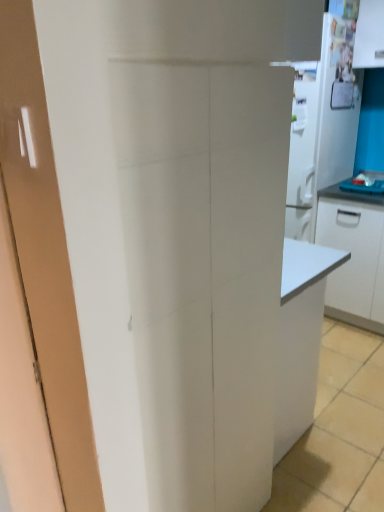
Question: Can you confirm if white glossy refrigerator at upper right is positioned to the left of blue laminate countertop at right?

Choices:
 (A) no
 (B) yes

Answer: (B)

Question: From the image's perspective, is white glossy refrigerator at upper right beneath blue laminate countertop at right?

Choices:
 (A) yes
 (B) no

Answer: (B)

Question: Is white glossy refrigerator at upper right positioned with its back to blue laminate countertop at right?

Choices:
 (A) no
 (B) yes

Answer: (A)

Question: Is white glossy refrigerator at upper right further to camera compared to blue laminate countertop at right?

Choices:
 (A) yes
 (B) no

Answer: (B)

Question: Does white glossy refrigerator at upper right have a lesser height compared to blue laminate countertop at right?

Choices:
 (A) no
 (B) yes

Answer: (A)

Question: Can you confirm if white glossy refrigerator at upper right is taller than blue laminate countertop at right?

Choices:
 (A) yes
 (B) no

Answer: (A)

Question: Is blue laminate countertop at right positioned beyond the bounds of white glossy cabinet at right?

Choices:
 (A) no
 (B) yes

Answer: (A)

Question: From the image's perspective, is blue laminate countertop at right located beneath white glossy cabinet at right?

Choices:
 (A) yes
 (B) no

Answer: (B)

Question: Can white glossy cabinet at right be found inside blue laminate countertop at right?

Choices:
 (A) yes
 (B) no

Answer: (B)

Question: Does blue laminate countertop at right turn towards white glossy cabinet at right?

Choices:
 (A) no
 (B) yes

Answer: (B)

Question: Is blue laminate countertop at right not near white glossy cabinet at right?

Choices:
 (A) no
 (B) yes

Answer: (A)

Question: From a real-world perspective, is blue laminate countertop at right under white glossy cabinet at right?

Choices:
 (A) yes
 (B) no

Answer: (B)

Question: Could white glossy cabinet at right be considered to be inside white glossy refrigerator at upper right?

Choices:
 (A) yes
 (B) no

Answer: (B)